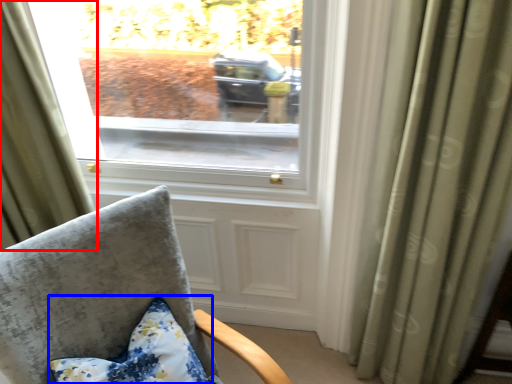
Question: Which point is further to the camera, curtain (highlighted by a red box) or pillow (highlighted by a blue box)?

Choices:
 (A) curtain
 (B) pillow

Answer: (A)